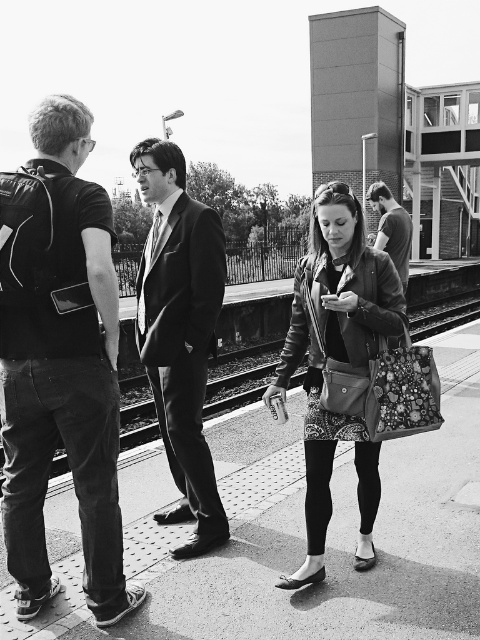
You are standing at the train station platform and need to reach the leather jacket at center quickly. There is a black fabric backpack at left blocking your path. Can you walk around it without moving the backpack?

The black fabric backpack at left is 3.30 feet away from the leather jacket at center. Since the backpack is only 3.30 feet away from the jacket, there is enough space to walk around it without needing to move the backpack.

You are a photographer trying to capture a photo of the leather jacket at center without including the black fabric backpack at left in the frame. Based on their positions, is this possible?

The black fabric backpack at left is in front of the leather jacket at center, so it would block the view of the leather jacket at center. Therefore, it is not possible to capture the leather jacket at center without including the black fabric backpack at left in the frame.

You are a traveler at the train station and need to store your black fabric backpack at left and leather jacket at center. The storage locker has a maximum capacity of 10 liters. Which item can fit into the locker without exceeding the capacity?

The black fabric backpack at left is smaller than the leather jacket at center, so the black fabric backpack at left can fit into the locker without exceeding the capacity.